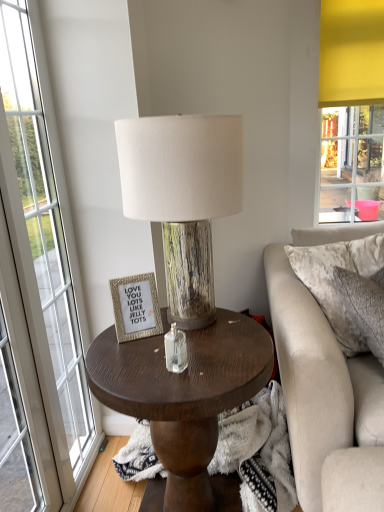
Question: Would you say velvet beige pillow at right contains wood grain lampshade at center?

Choices:
 (A) no
 (B) yes

Answer: (A)

Question: Is velvet beige pillow at right at the left side of wood grain lampshade at center?

Choices:
 (A) no
 (B) yes

Answer: (A)

Question: Is velvet beige pillow at right facing towards wood grain lampshade at center?

Choices:
 (A) yes
 (B) no

Answer: (B)

Question: Is velvet beige pillow at right further to the viewer compared to wood grain lampshade at center?

Choices:
 (A) no
 (B) yes

Answer: (B)

Question: Considering the relative sizes of velvet beige pillow at right and wood grain lampshade at center in the image provided, is velvet beige pillow at right shorter than wood grain lampshade at center?

Choices:
 (A) no
 (B) yes

Answer: (B)

Question: Is dark wood coffee table at center taller or shorter than wood grain lampshade at center?

Choices:
 (A) tall
 (B) short

Answer: (A)

Question: From the image's perspective, is dark wood coffee table at center above or below wood grain lampshade at center?

Choices:
 (A) below
 (B) above

Answer: (A)

Question: Considering the positions of point (102, 393) and point (127, 120), is point (102, 393) closer or farther from the camera than point (127, 120)?

Choices:
 (A) closer
 (B) farther

Answer: (A)

Question: In terms of size, does dark wood coffee table at center appear bigger or smaller than wood grain lampshade at center?

Choices:
 (A) big
 (B) small

Answer: (A)

Question: Considering the positions of point (309, 251) and point (145, 414), is point (309, 251) closer or farther from the camera than point (145, 414)?

Choices:
 (A) closer
 (B) farther

Answer: (B)

Question: Considering the positions of velvet beige pillow at right and dark wood coffee table at center in the image, is velvet beige pillow at right bigger or smaller than dark wood coffee table at center?

Choices:
 (A) small
 (B) big

Answer: (A)

Question: Is velvet beige pillow at right inside or outside of dark wood coffee table at center?

Choices:
 (A) outside
 (B) inside

Answer: (A)

Question: In terms of height, does velvet beige pillow at right look taller or shorter compared to dark wood coffee table at center?

Choices:
 (A) short
 (B) tall

Answer: (A)

Question: From their relative heights in the image, would you say gold textured picture frame at upper center is taller or shorter than velvet beige pillow at right?

Choices:
 (A) short
 (B) tall

Answer: (A)

Question: From the image's perspective, is gold textured picture frame at upper center located above or below velvet beige pillow at right?

Choices:
 (A) above
 (B) below

Answer: (B)